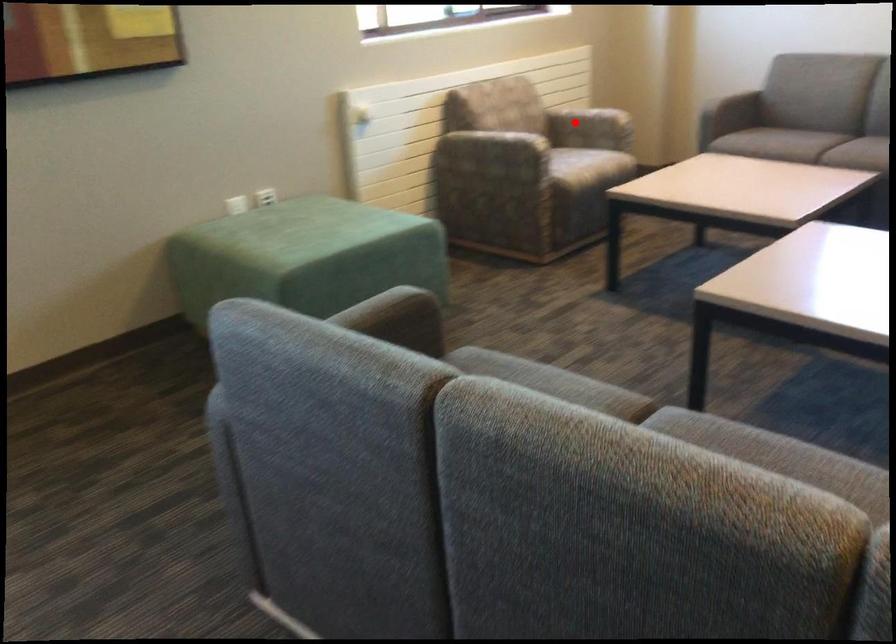
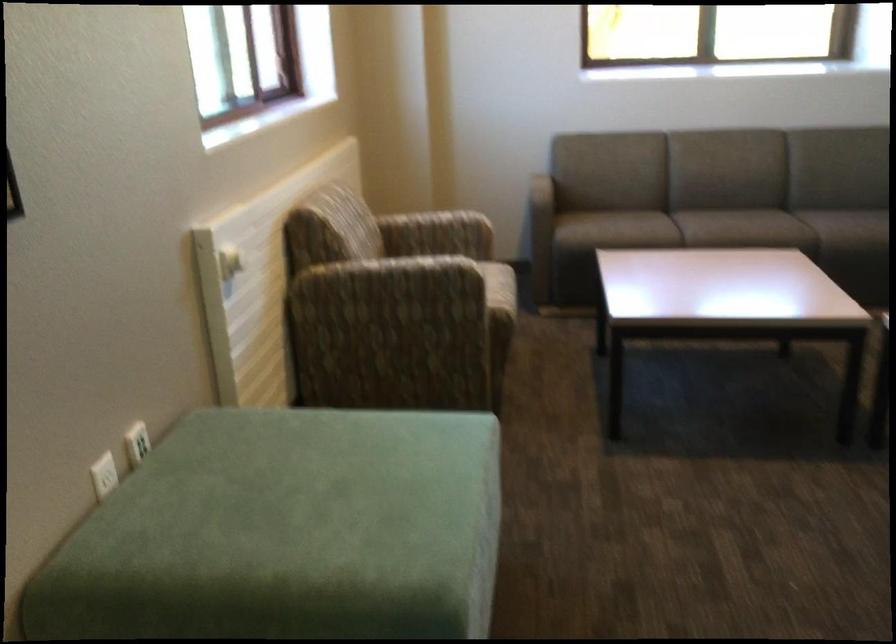
Question: I am providing you with two images of the same scene from different viewpoints. A red point is shown in image1. For the corresponding object point in image2, is it positioned nearer or farther from the camera?

Choices:
 (A) Nearer
 (B) Farther

Answer: (A)